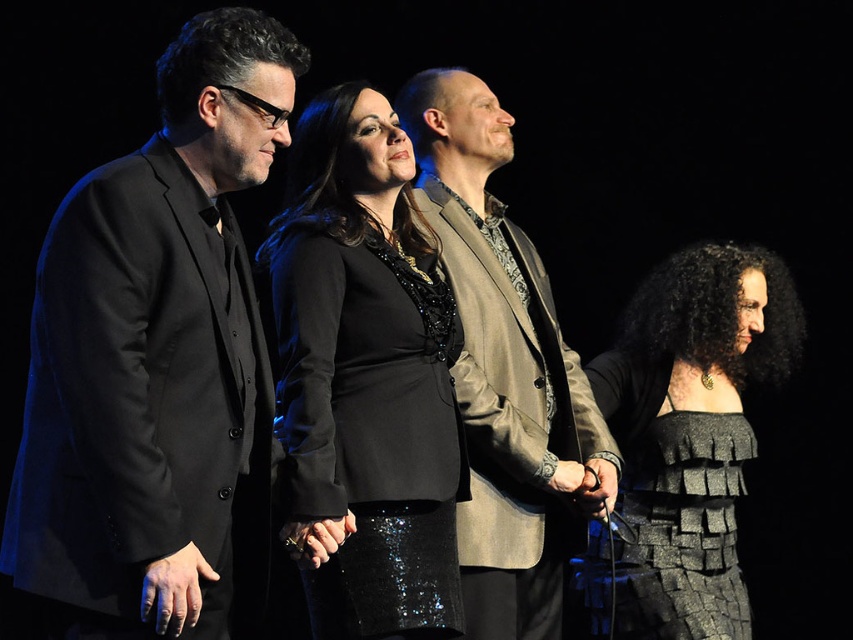
Question: Is matte black suit at left below black sequined dress at center?

Choices:
 (A) yes
 (B) no

Answer: (B)

Question: Based on their relative distances, which object is farther from the matte black suit at left?

Choices:
 (A) shiny metallic dress at center
 (B) shiny beige suit at center
 (C) black sequined dress at center
 (D) textured gray dress at lower right

Answer: (A)

Question: Estimate the real-world distances between objects in this image. Which object is farther from the matte black suit at left?

Choices:
 (A) textured gray dress at lower right
 (B) shiny metallic dress at center

Answer: (B)

Question: Among these points, which one is nearest to the camera?

Choices:
 (A) (106, 368)
 (B) (393, 547)
 (C) (627, 564)

Answer: (A)

Question: Is black sequined dress at center positioned before shiny beige suit at center?

Choices:
 (A) no
 (B) yes

Answer: (B)

Question: Observing the image, what is the correct spatial positioning of shiny beige suit at center in reference to textured gray dress at lower right?

Choices:
 (A) above
 (B) below

Answer: (A)